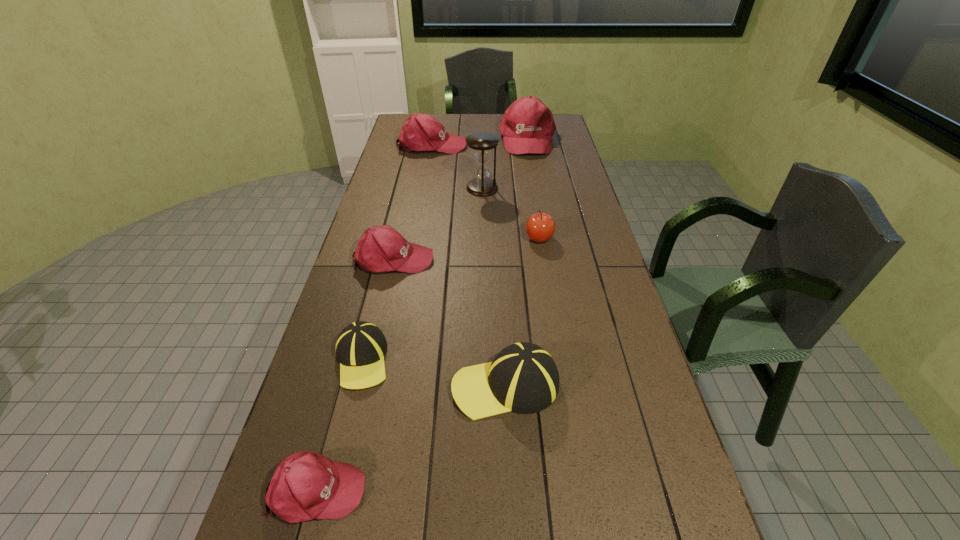
This screenshot has height=540, width=960. What are the coordinates of `free spot between the sixth nearest object and the fourth nearest baseball cap` in the screenshot? It's located at (438, 224).

Identify the location of vacant area that lies between the rightmost red baseball cap and the bigger black baseball cap. The height and width of the screenshot is (540, 960). (516, 262).

I want to click on unoccupied area between the fourth nearest baseball cap and the smaller black baseball cap, so click(377, 309).

Locate an element on the screen. vacant space in between the rightmost red baseball cap and the smallest red baseball cap is located at coordinates (422, 314).

The image size is (960, 540). I want to click on object that ranks as the closest to the fourth nearest baseball cap, so click(360, 347).

Locate an element on the screen. The width and height of the screenshot is (960, 540). the fifth closest object relative to the left black baseball cap is located at coordinates (482, 143).

I want to click on baseball cap identified as the third closest to the tallest baseball cap, so click(360, 347).

Identify the location of baseball cap that can be found as the fifth closest to the smaller black baseball cap. (527, 126).

Identify which red baseball cap is the fourth nearest to the sixth nearest object. Please provide its 2D coordinates. Your answer should be formatted as a tuple, i.e. [(x, y)], where the tuple contains the x and y coordinates of a point satisfying the conditions above.

[(306, 485)]

Select which red baseball cap is the second closest to the second tallest object. Please provide its 2D coordinates. Your answer should be formatted as a tuple, i.e. [(x, y)], where the tuple contains the x and y coordinates of a point satisfying the conditions above.

[(381, 248)]